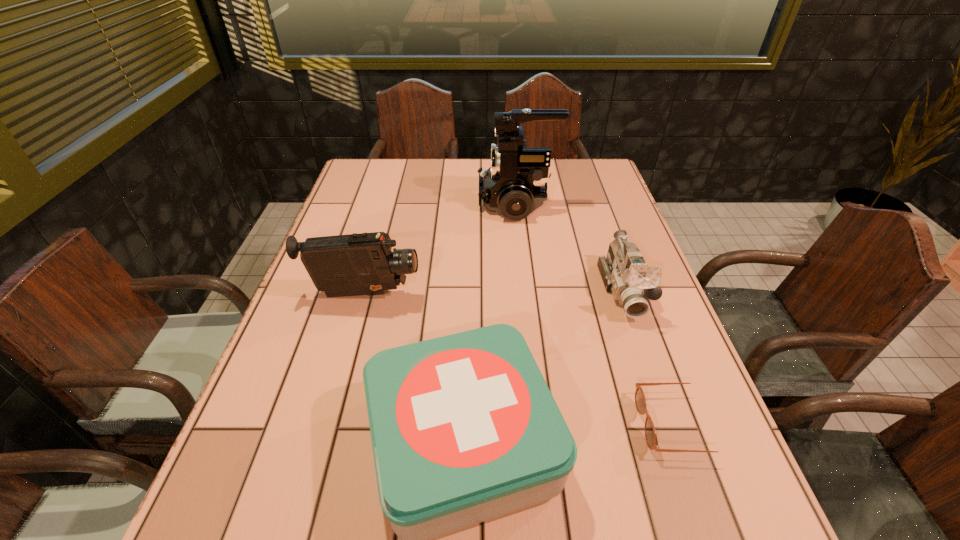
Where is `free point at the right edge`? The height and width of the screenshot is (540, 960). free point at the right edge is located at coordinates (632, 399).

This screenshot has height=540, width=960. In the image, there is a desktop. In order to click on vacant area at the far left corner in this screenshot , I will do `click(350, 177)`.

Locate an element on the screen. The width and height of the screenshot is (960, 540). vacant area at the far right corner of the desktop is located at coordinates (564, 183).

Image resolution: width=960 pixels, height=540 pixels. In order to click on free space between the shortest camcorder and the tallest camcorder in this screenshot , I will do `click(570, 246)`.

You are a GUI agent. You are given a task and a screenshot of the screen. Output one action in this format:
    pyautogui.click(x=<x>, y=<y>)
    Task: Click on the free space between the tallest camcorder and the shortest camcorder
    
    Given the screenshot: What is the action you would take?
    pyautogui.click(x=570, y=246)

This screenshot has width=960, height=540. Find the location of `free spot between the sunglasses and the shortest camcorder`. free spot between the sunglasses and the shortest camcorder is located at coordinates (651, 357).

Where is `object that is the fourth closest to the leftmost camcorder`? This screenshot has height=540, width=960. object that is the fourth closest to the leftmost camcorder is located at coordinates (640, 401).

Identify the location of the second closest object relative to the leftmost camcorder. Image resolution: width=960 pixels, height=540 pixels. (515, 185).

Identify which camcorder is the closest to the second tallest object. Please provide its 2D coordinates. Your answer should be formatted as a tuple, i.e. [(x, y)], where the tuple contains the x and y coordinates of a point satisfying the conditions above.

[(515, 185)]

Where is `camcorder object that ranks as the second closest to the farthest camcorder`? This screenshot has width=960, height=540. camcorder object that ranks as the second closest to the farthest camcorder is located at coordinates (355, 264).